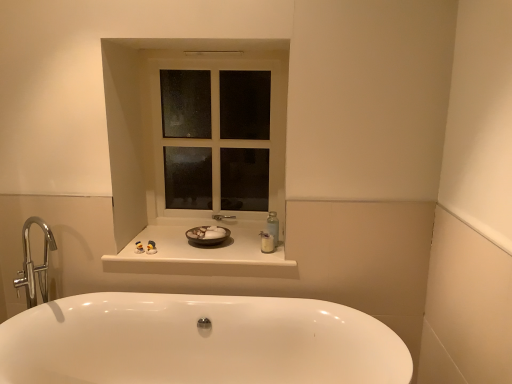
I want to click on unoccupied region to the right of white glossy toiletries at center, the 1th toiletry in the left-to-right sequence, so click(x=170, y=254).